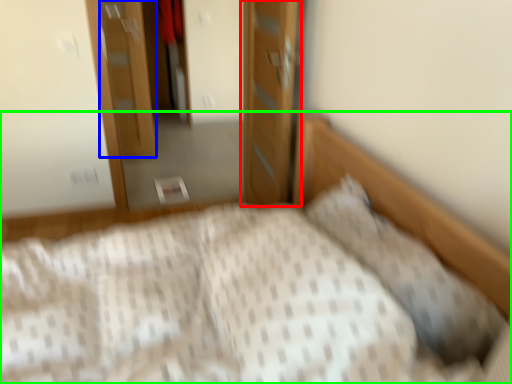
Question: Considering the real-world distances, which object is farthest from door (highlighted by a red box)? door (highlighted by a blue box) or bed (highlighted by a green box)?

Choices:
 (A) door
 (B) bed

Answer: (A)